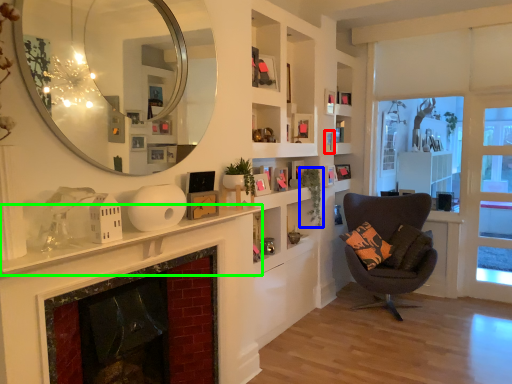
Question: Estimate the real-world distances between objects in this image. Which object is closer to picture frame (highlighted by a red box), plant (highlighted by a blue box) or mantle (highlighted by a green box)?

Choices:
 (A) plant
 (B) mantle

Answer: (A)